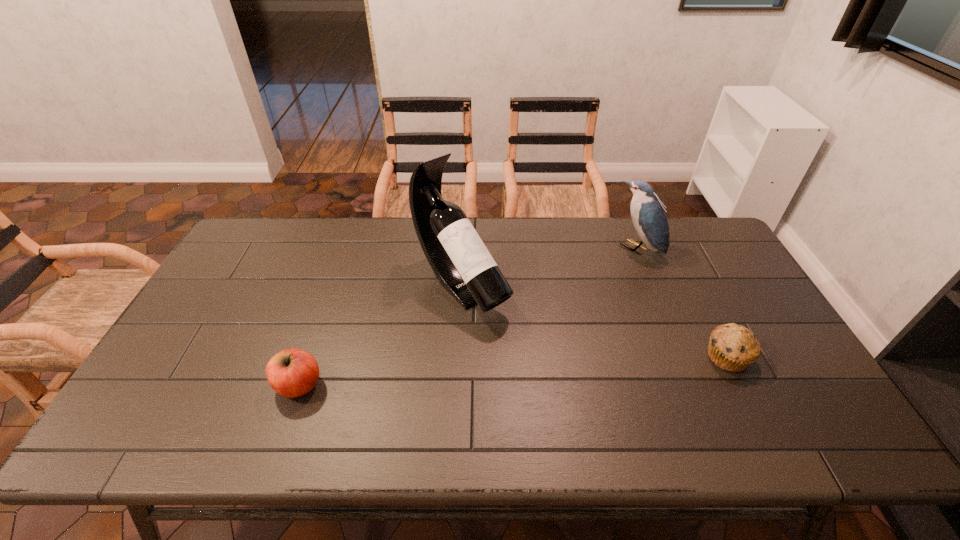
Identify the location of free area in between the muffin and the wine bottle. (594, 321).

Where is `blank region between the third shortest object and the shortest object`? blank region between the third shortest object and the shortest object is located at coordinates (682, 303).

This screenshot has height=540, width=960. What are the coordinates of `vacant space that's between the shortest object and the third shortest object` in the screenshot? It's located at (682, 303).

In order to click on object that stands as the closest to the muffin in this screenshot , I will do `click(648, 214)`.

Select which object is the third closest to the third shortest object. Please provide its 2D coordinates. Your answer should be formatted as a tuple, i.e. [(x, y)], where the tuple contains the x and y coordinates of a point satisfying the conditions above.

[(291, 373)]

At what (x,y) coordinates should I click in order to perform the action: click on free space that satisfies the following two spatial constraints: 1. on the front side of the third shortest object; 2. on the left side of the muffin. Please return your answer as a coordinate pair (x, y). The image size is (960, 540). Looking at the image, I should click on (681, 357).